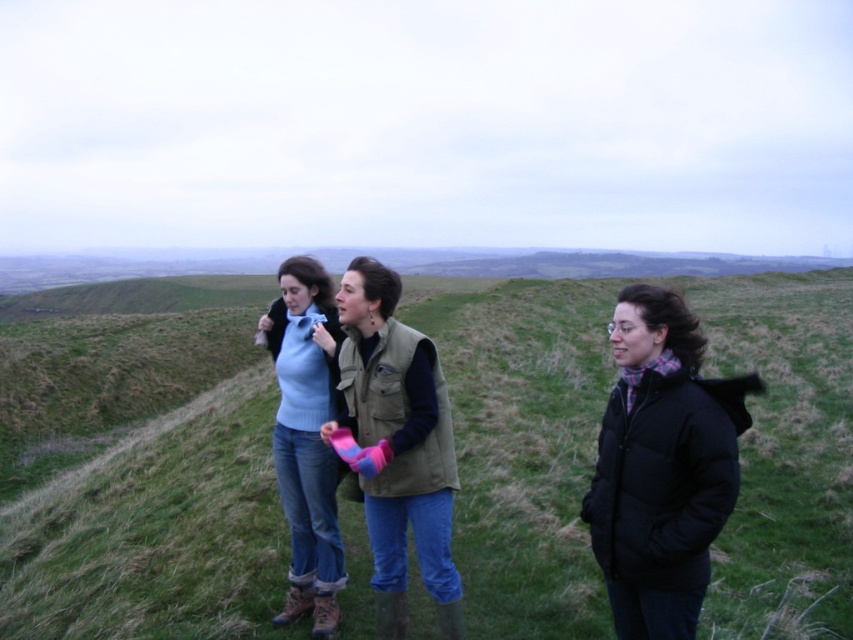
You are standing on the grassy hillside and want to locate the black puffy jacket at center. According to the coordinates provided, where should you look?

The black puffy jacket at center is located at coordinates point (662,467).

You are a photographer trying to capture a clear shot of the khaki fabric vest at center and the light blue sweater at center. Which of the two clothing items will appear closer to the camera in the photo?

The khaki fabric vest at center will appear closer to the camera because it is in front of the light blue sweater at center.